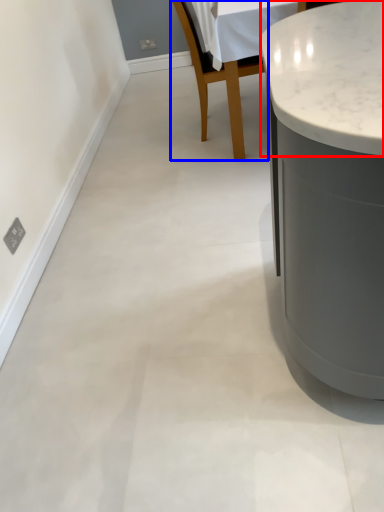
Question: Which of the following is the farthest to the observer, counter top (highlighted by a red box) or chair (highlighted by a blue box)?

Choices:
 (A) counter top
 (B) chair

Answer: (B)